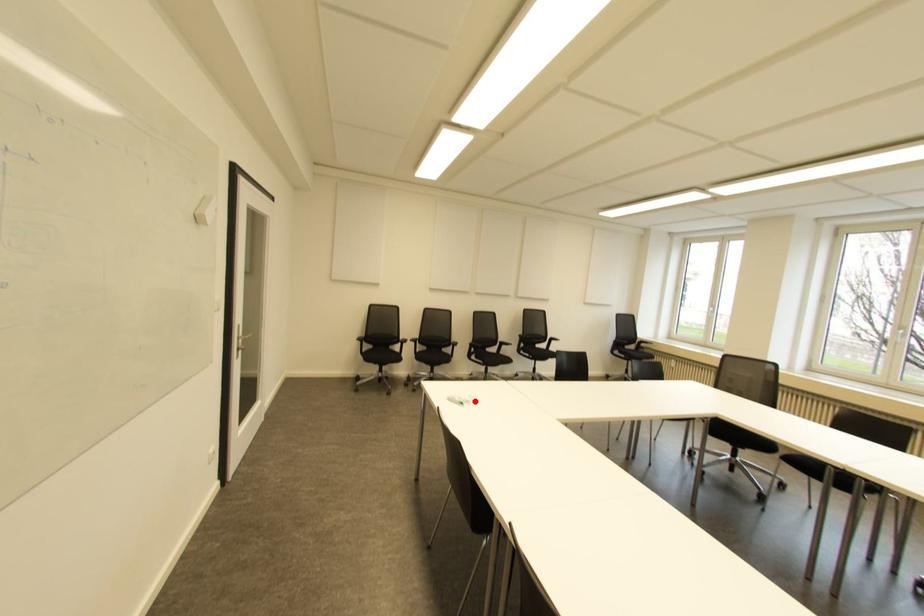
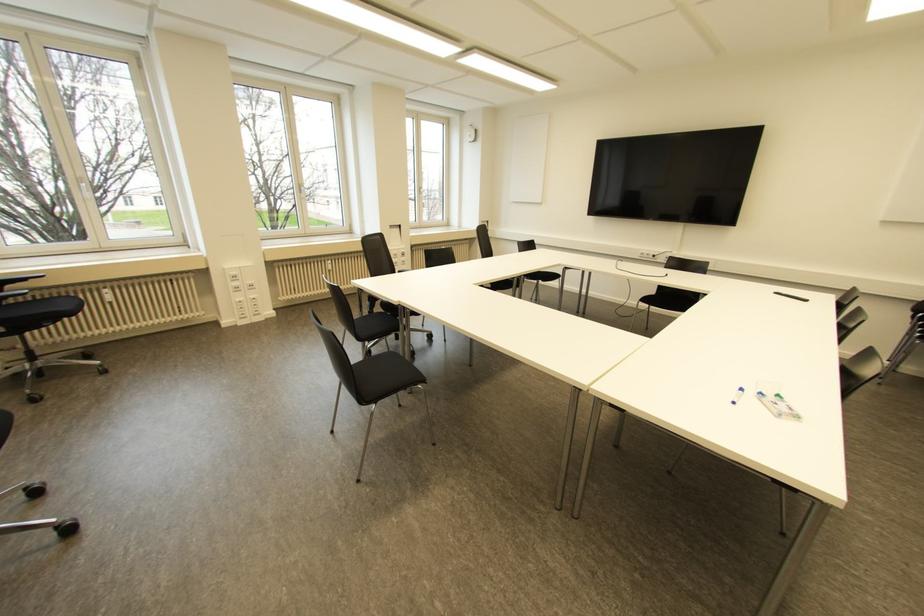
Question: I am providing you with two images of the same scene from different viewpoints. Given a red point in image1, look at the same physical point in image2. Is it:

Choices:
 (A) Closer to the viewpoint
 (B) Farther from the viewpoint

Answer: (B)